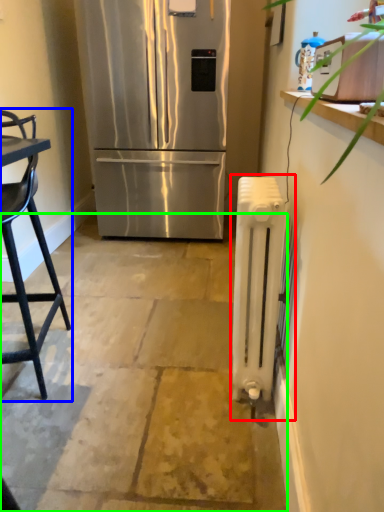
Question: Based on their relative distances, which object is nearer to radiator (highlighted by a red box)? Choose from chair (highlighted by a blue box) and concrete (highlighted by a green box).

Choices:
 (A) chair
 (B) concrete

Answer: (B)